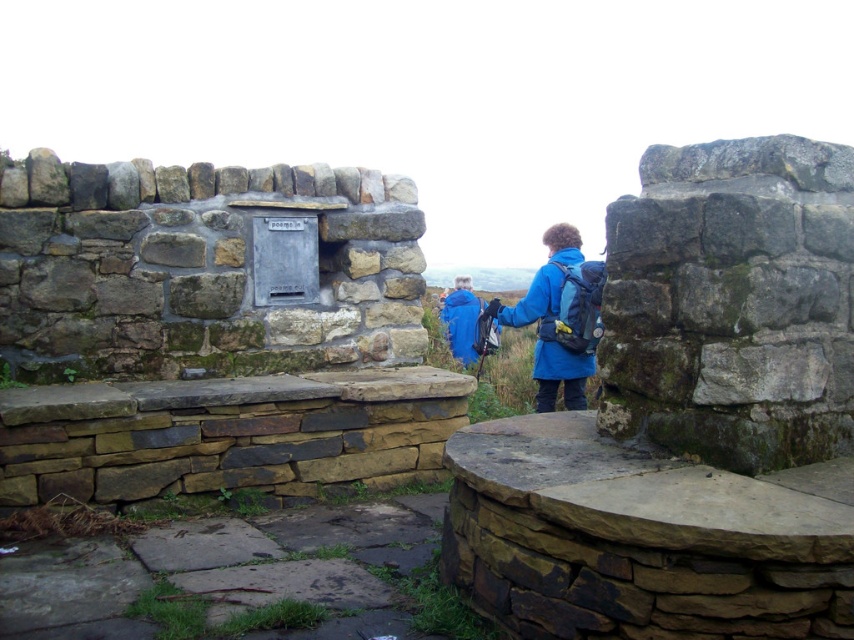
You are trying to decide which jacket to take for a hike. You have both the blue fabric jacket at center and the blue synthetic jacket at center. If you want to carry a backpack, which jacket might be better to choose based on their widths?

The blue fabric jacket at center might be wider than the blue synthetic jacket at center, so it might be harder to fit under a backpack. The blue synthetic jacket at center could be a better choice as it might be narrower and easier to layer under a backpack.